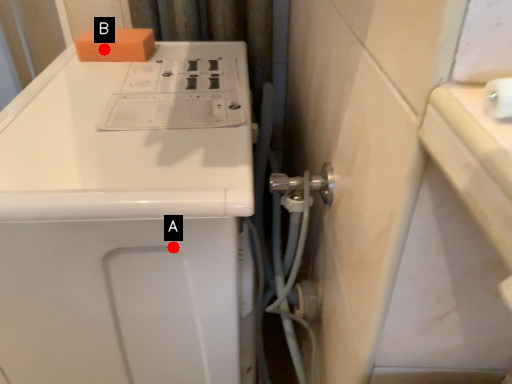
Question: Two points are circled on the image, labeled by A and B beside each circle. Which of the following is the closest to the observer?

Choices:
 (A) A is closer
 (B) B is closer

Answer: (A)